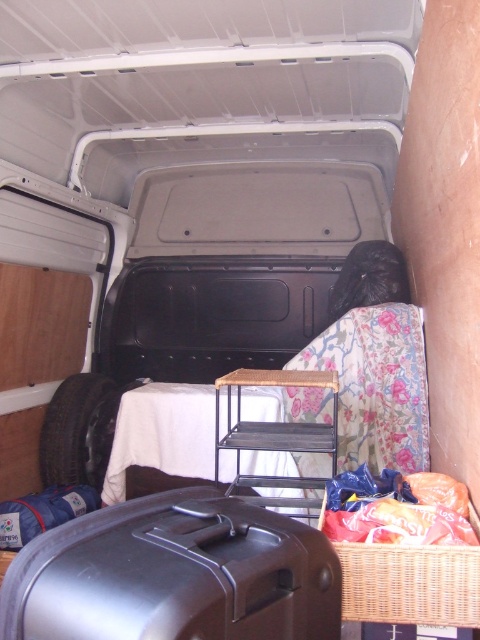
Is plastic bagged food at lower right further to the viewer compared to black rubber tire at left?

No, it is not.

Does plastic bagged food at lower right appear on the left side of black rubber tire at left?

In fact, plastic bagged food at lower right is to the right of black rubber tire at left.

Find the location of a particular element. The width and height of the screenshot is (480, 640). plastic bagged food at lower right is located at coordinates (389, 512).

Which is more to the right, woven brown basket at lower right or plastic bagged food at lower right?

Positioned to the right is woven brown basket at lower right.

Image resolution: width=480 pixels, height=640 pixels. Identify the location of woven brown basket at lower right. (409, 582).

The width and height of the screenshot is (480, 640). I want to click on woven brown basket at lower right, so click(409, 582).

Is point (108, 280) closer to viewer compared to point (132, 570)?

That is False.

Is point (335, 99) more distant than point (105, 628)?

That is True.

Is point (129, 100) positioned behind point (262, 588)?

Yes, it is.

Where is `floral fabric chair at center`? floral fabric chair at center is located at coordinates (200, 166).